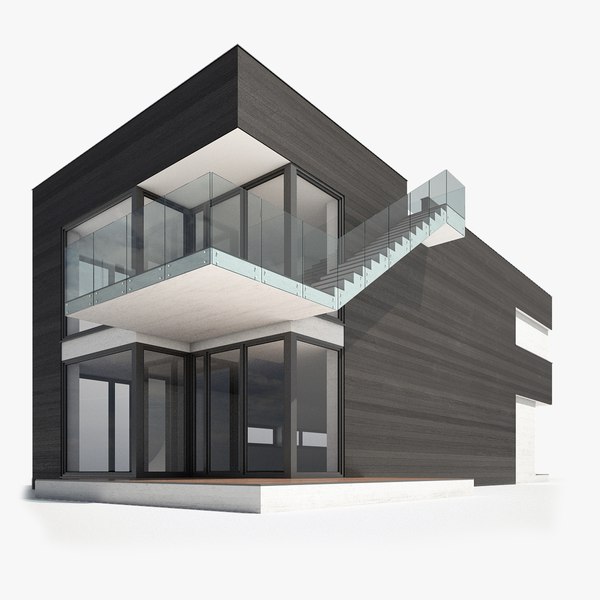
What are the coordinates of `bottom right corner empty space` in the screenshot? It's located at (596, 596).